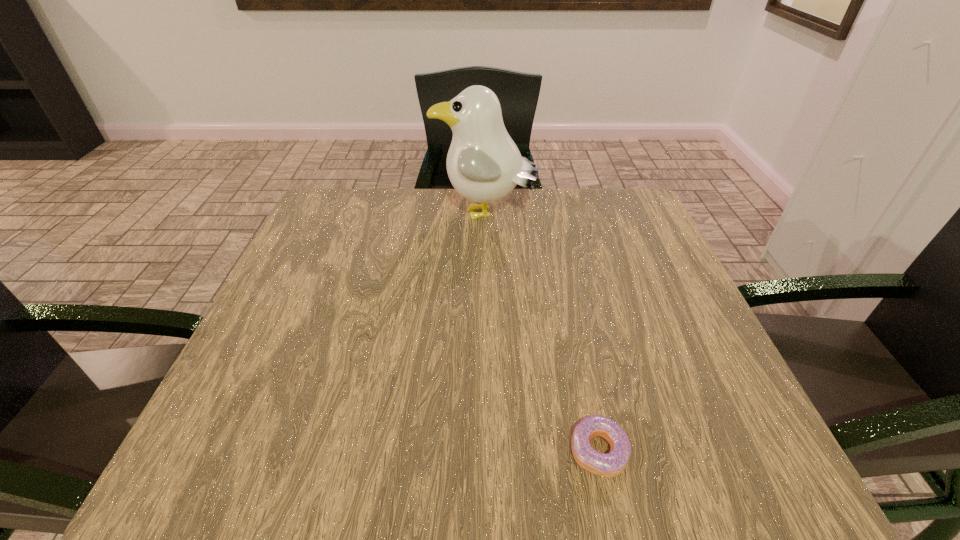
This screenshot has width=960, height=540. In order to click on gull in this screenshot , I will do `click(483, 163)`.

Identify the location of the taller object. (483, 163).

The width and height of the screenshot is (960, 540). Find the location of `the shorter object`. the shorter object is located at coordinates (612, 464).

At what (x,y) coordinates should I click in order to perform the action: click on doughnut. Please return your answer as a coordinate pair (x, y). The width and height of the screenshot is (960, 540). Looking at the image, I should click on (612, 464).

Find the location of a particular element. The width and height of the screenshot is (960, 540). free region located 0.150m on the beak of the farther object is located at coordinates (374, 216).

This screenshot has height=540, width=960. What are the coordinates of `vacant space situated on the beak of the farther object` in the screenshot? It's located at click(362, 216).

Where is `vacant point located on the beak of the farther object`? The width and height of the screenshot is (960, 540). vacant point located on the beak of the farther object is located at coordinates (398, 216).

You are a GUI agent. You are given a task and a screenshot of the screen. Output one action in this format:
    pyautogui.click(x=<x>, y=<y>)
    Task: Click on the free spot located on the back of the nearer object
    
    Given the screenshot: What is the action you would take?
    pyautogui.click(x=560, y=268)

Locate an element on the screen. The width and height of the screenshot is (960, 540). object at the far edge is located at coordinates (483, 163).

Where is `object present at the near edge`? object present at the near edge is located at coordinates (612, 464).